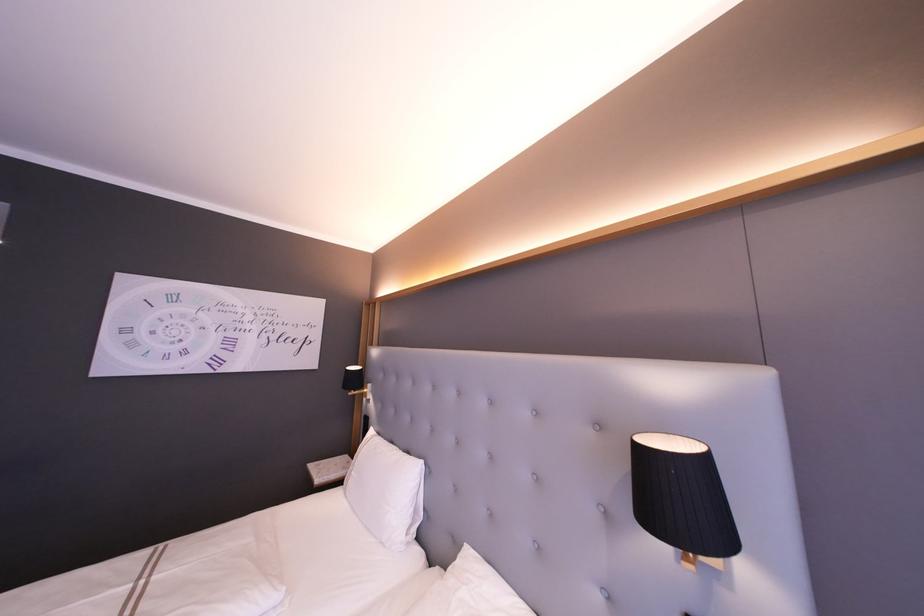
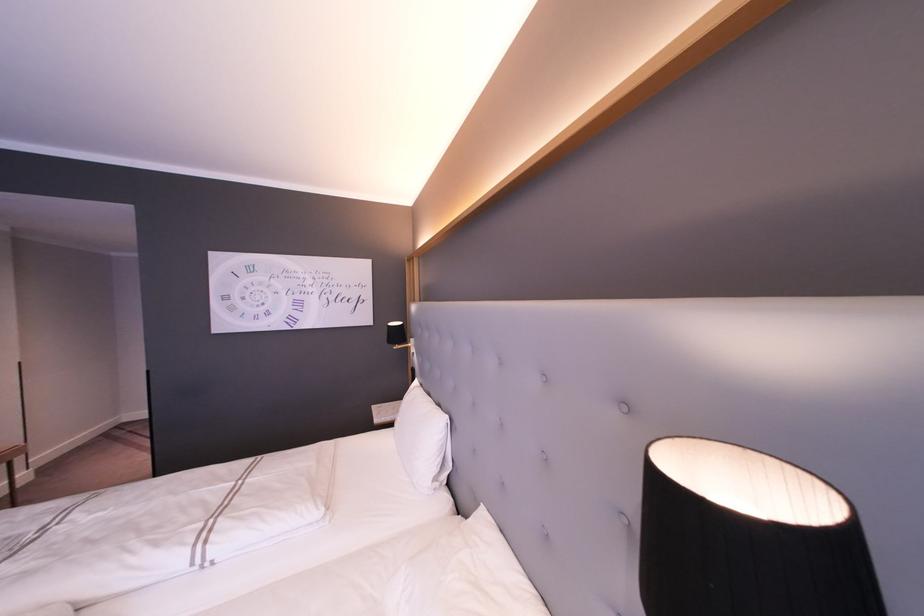
What movement of the cameraman would produce the second image?

The cameraman walked toward right, forward.